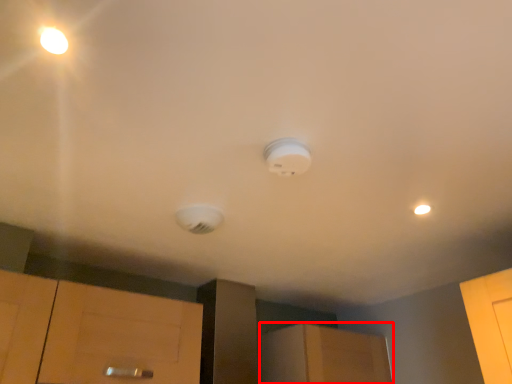
Question: From the image's perspective, what is the correct spatial relationship of cabinetry (annotated by the red box) in relation to lamp?

Choices:
 (A) above
 (B) below

Answer: (B)